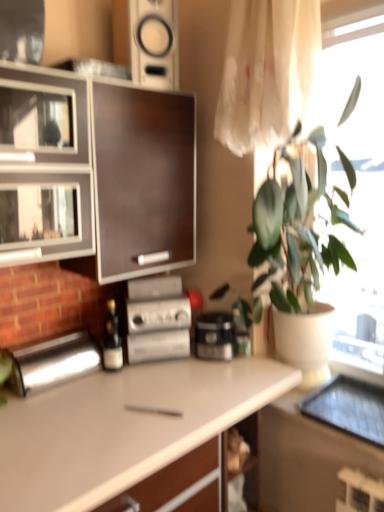
Locate an element on the screen. free space in front of silver metallic stereo at center, acting as the 2th appliance starting from the left is located at coordinates (160, 383).